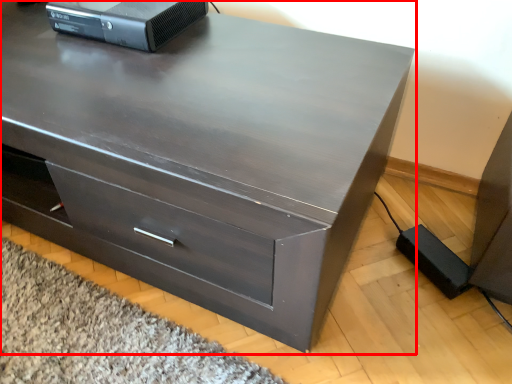
Question: From the image's perspective, where is chest of drawers (annotated by the red box) located in relation to desktop computer in the image?

Choices:
 (A) above
 (B) below

Answer: (B)